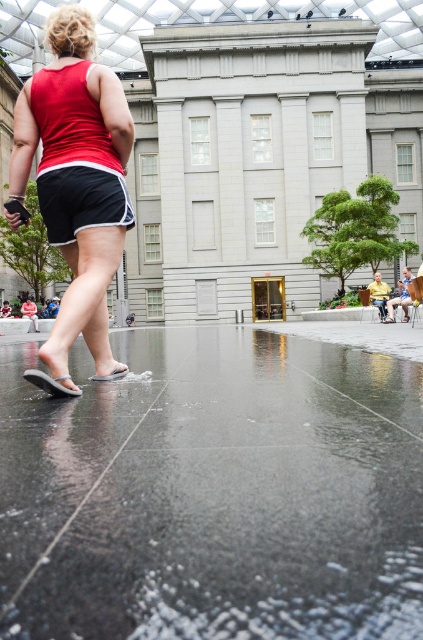
Which of these two, matte red tank top at center or white rubber sandal at lower center, stands shorter?

Standing shorter between the two is white rubber sandal at lower center.

Does matte red tank top at center have a smaller size compared to white rubber sandal at lower center?

No.

Which is behind, point (57, 317) or point (126, 369)?

The point (126, 369) is behind.

At what (x,y) coordinates should I click in order to perform the action: click on matte red tank top at center. Please return your answer as a coordinate pair (x, y). Looking at the image, I should click on (76, 177).

Between glossy concrete pavement at lower center and white rubber sandal at lower left, which one is positioned higher?

white rubber sandal at lower left is above.

Looking at this image, can you confirm if glossy concrete pavement at lower center is positioned above white rubber sandal at lower left?

No.

Identify the location of glossy concrete pavement at lower center. (214, 492).

This screenshot has height=640, width=423. What are the coordinates of `glossy concrete pavement at lower center` in the screenshot? It's located at (214, 492).

This screenshot has width=423, height=640. In order to click on glossy concrete pavement at lower center in this screenshot , I will do `click(214, 492)`.